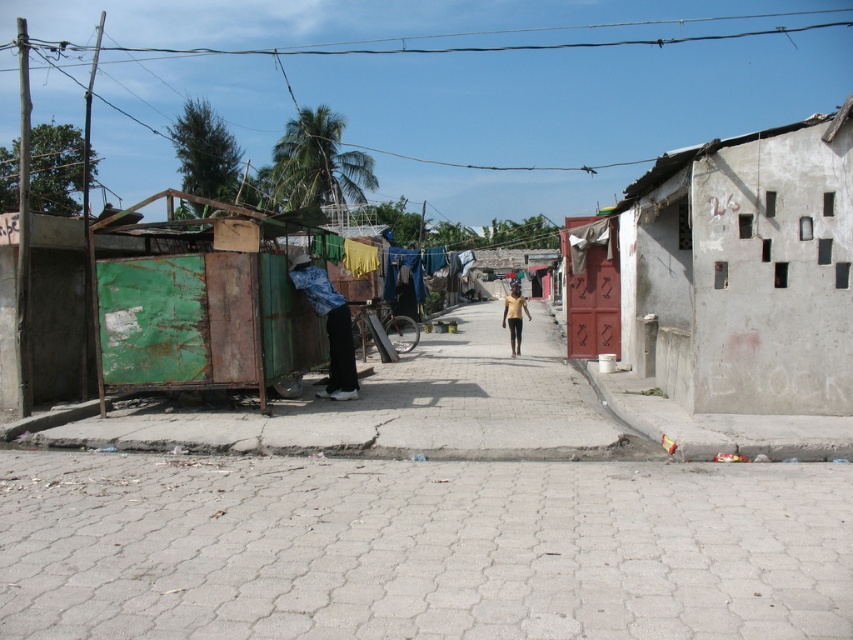
You are a delivery person trying to navigate through the narrow street. You see the rusty metal container at left and the gold metallic person at center. Which object is wider, requiring more space to pass around?

The rusty metal container at left is wider than the gold metallic person at center, so you need more space to pass around it.

You are a delivery person trying to navigate through the narrow street. You see a rusty metal container at left and a denim jacket at left. Which object is closer to the ground?

The rusty metal container at left is located below the denim jacket at left, so it is closer to the ground.